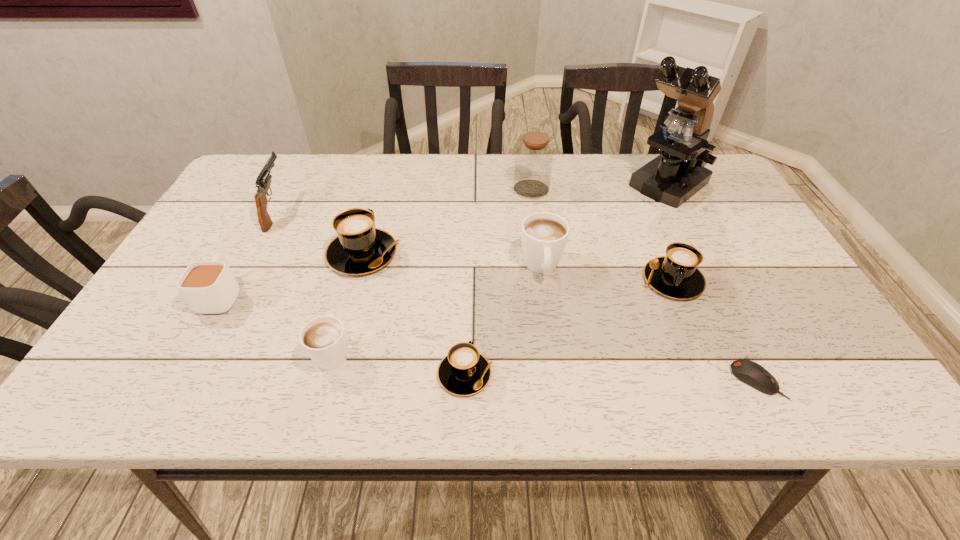
Where is `the smaller white cappuccino`? The height and width of the screenshot is (540, 960). the smaller white cappuccino is located at coordinates (323, 338).

This screenshot has width=960, height=540. I want to click on the left white cappuccino, so click(323, 338).

Identify the location of the smallest black cappuccino. (464, 371).

This screenshot has width=960, height=540. I want to click on the nearest black cappuccino, so click(x=464, y=371).

Locate an element on the screen. The width and height of the screenshot is (960, 540). computer mouse is located at coordinates (749, 372).

I want to click on vacant space located on the front of the tallest object, so pos(696,248).

The image size is (960, 540). Find the location of `vacant space situated 0.280m on the right of the second tallest object`. vacant space situated 0.280m on the right of the second tallest object is located at coordinates (644, 190).

Locate an element on the screen. This screenshot has height=540, width=960. blank space located along the barrel of the black gun is located at coordinates (304, 155).

Where is `free space located 0.070m along the barrel of the black gun`? Image resolution: width=960 pixels, height=540 pixels. free space located 0.070m along the barrel of the black gun is located at coordinates (294, 176).

Locate an element on the screen. The image size is (960, 540). vacant position located along the barrel of the black gun is located at coordinates (304, 155).